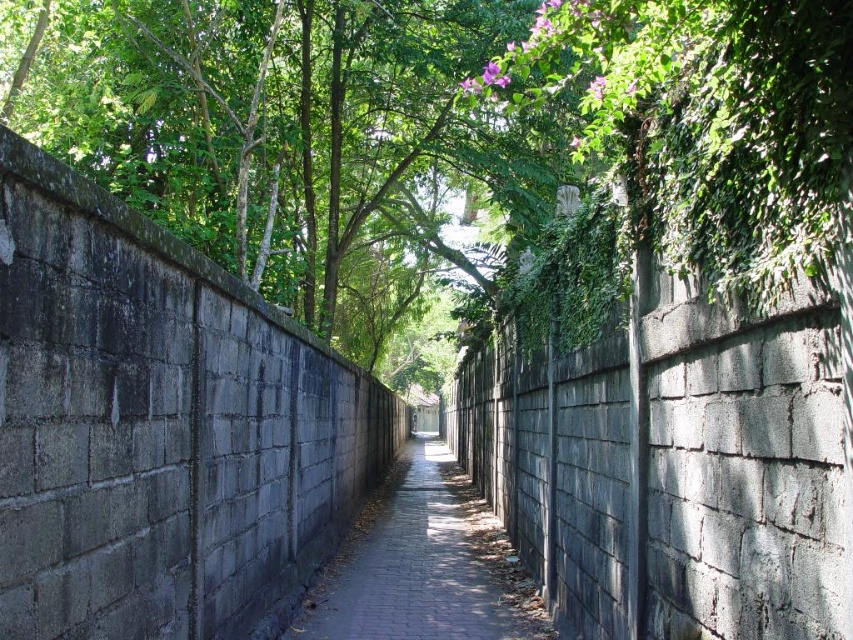
You are a delivery person trying to navigate through the alley. You need to deliver a package to the address located at the end of the alley. The tree might block your path. Is the green leafy tree at upper center positioned to the left or right side of the gray brick pavement at center?

The green leafy tree at upper center is to the left of the gray brick pavement at center, so it is positioned to the left side of the pavement.

You are a delivery person carrying a large package. You need to navigate through the narrow alleyway. The green leafy tree at upper center and the gray brick pavement at center are in your path. Which object will block your path more due to its size?

The green leafy tree at upper center will block your path more because it is larger in size than the gray brick pavement at center.

You are standing at the entrance of the alleyway and want to reach the green leafy tree at upper center. Which direction should you move in to get closer to it?

The green leafy tree at upper center is located at point coordinates of 0.195 on the x axis and 0.329 on the y axis, so you should move towards the upper center direction to reach it.